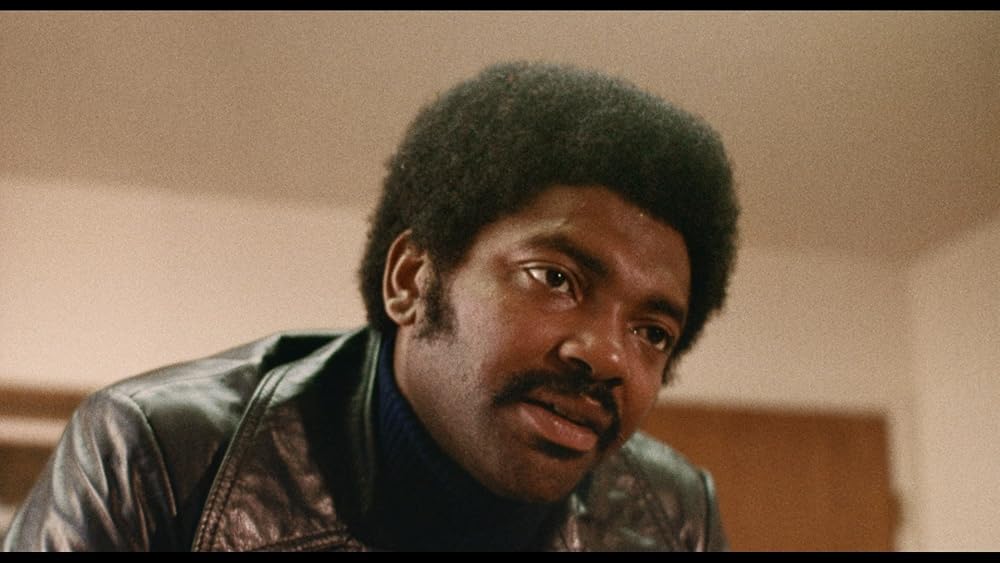
The image size is (1000, 563). Identify the location of ceiling. (344, 84).